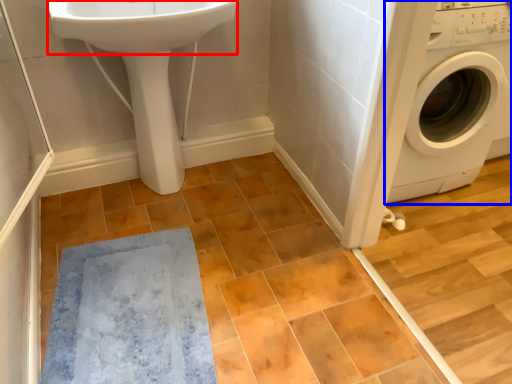
Question: Which point is further to the camera, sink (highlighted by a red box) or washing machine (highlighted by a blue box)?

Choices:
 (A) sink
 (B) washing machine

Answer: (B)